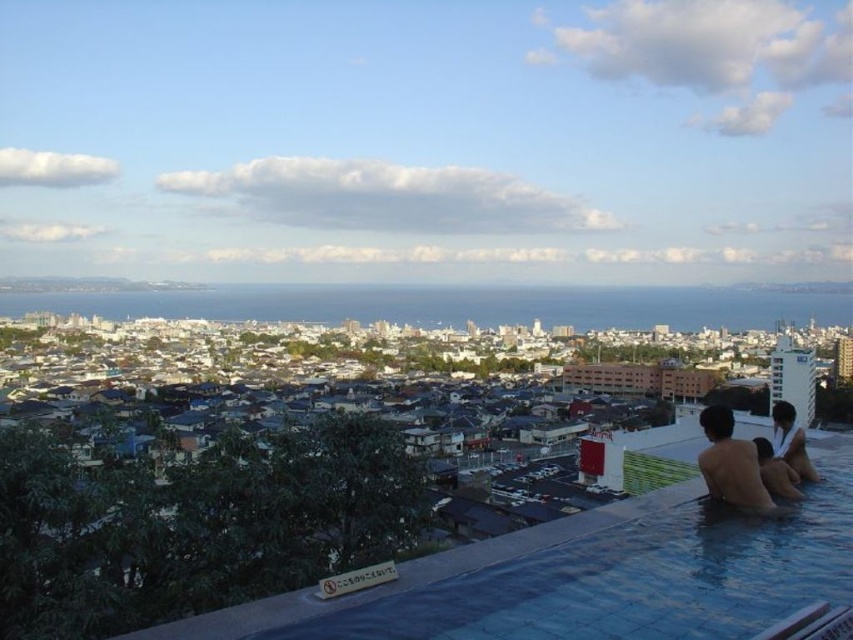
You are a drone operator tasked with capturing aerial footage of the rooftop scene. You need to fly between the skinny man at lower right and the smooth skin man at lower right to get the best shot. Considering the safety regulations require a minimum distance of 100 feet between the drone and any person, is this flight path feasible?

The distance between the skinny man at lower right and the smooth skin man at lower right is 146.44 feet. Since the required minimum distance is 100 feet, the drone can safely fly between them as the distance exceeds the safety regulation requirement.